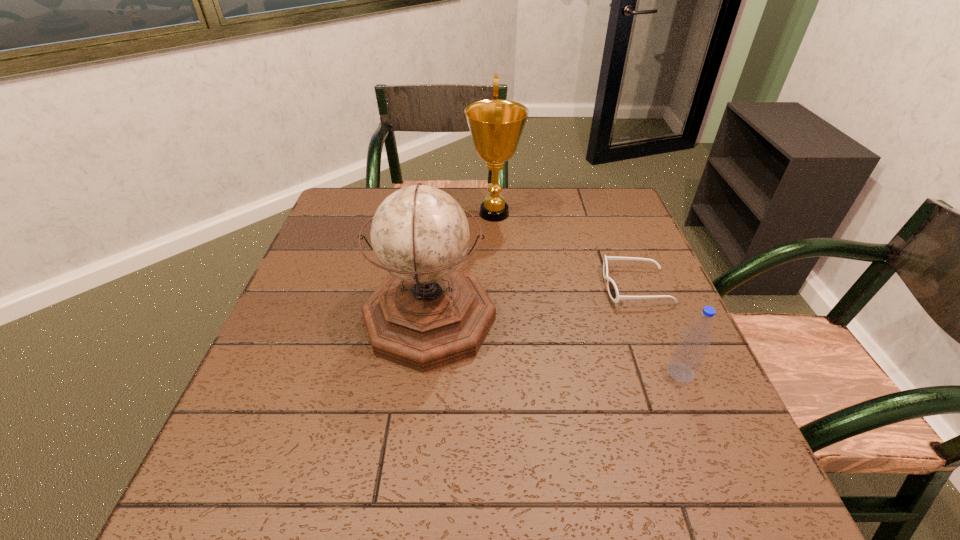
I want to click on the farthest object, so click(496, 126).

This screenshot has height=540, width=960. I want to click on globe, so click(x=426, y=314).

Where is `water bottle`? Image resolution: width=960 pixels, height=540 pixels. water bottle is located at coordinates 688,356.

Image resolution: width=960 pixels, height=540 pixels. Identify the location of sunglasses. (613, 292).

Where is `free spot located on the front view with handles of the award`? free spot located on the front view with handles of the award is located at coordinates (391, 213).

Where is `vacant space located 0.090m on the front view with handles of the award`? vacant space located 0.090m on the front view with handles of the award is located at coordinates (437, 213).

At what (x,y) coordinates should I click in order to perform the action: click on vacant space situated 0.150m on the front view with handles of the award. Please return your answer as a coordinate pair (x, y). Image resolution: width=960 pixels, height=540 pixels. Looking at the image, I should click on (418, 213).

Where is `vacant region located on the surface of the globe`? Image resolution: width=960 pixels, height=540 pixels. vacant region located on the surface of the globe is located at coordinates (517, 319).

Locate an element on the screen. The width and height of the screenshot is (960, 540). free space located on the left of the water bottle is located at coordinates (593, 373).

You are a GUI agent. You are given a task and a screenshot of the screen. Output one action in this format:
    pyautogui.click(x=<x>, y=<y>)
    Task: Click on the free space located with the lenses of the shortest object facing outward
    The height and width of the screenshot is (540, 960).
    Given the screenshot: What is the action you would take?
    pyautogui.click(x=515, y=286)